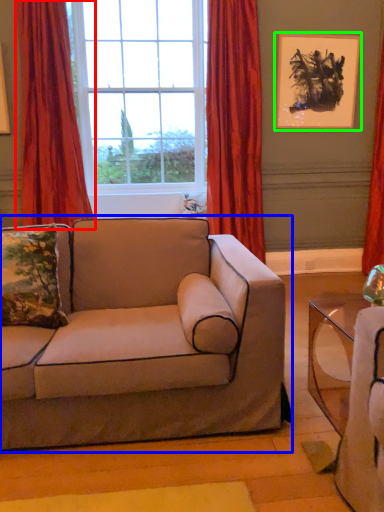
Question: Which is nearer to the curtain (highlighted by a red box)? studio couch (highlighted by a blue box) or picture frame (highlighted by a green box).

Choices:
 (A) studio couch
 (B) picture frame

Answer: (A)